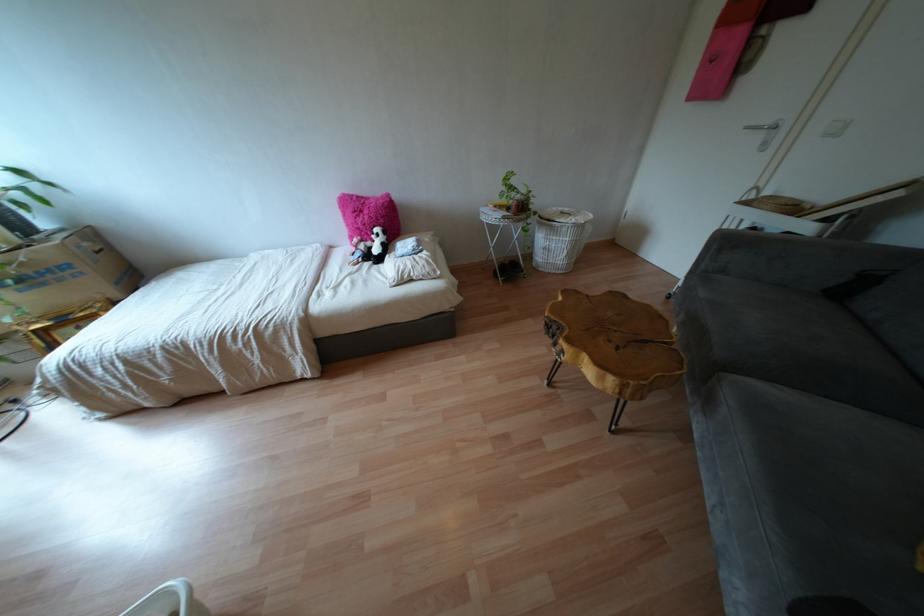
Where would you sit the sofa sitting surface? Please return your answer as a coordinate pair (x, y).

(819, 362)